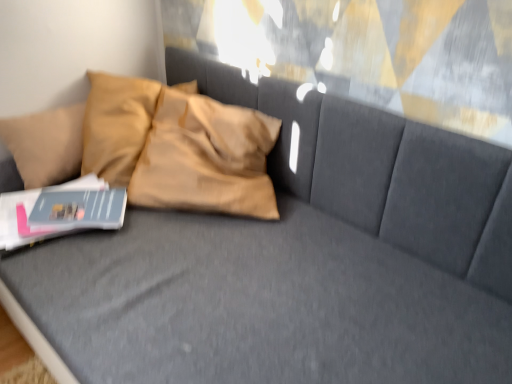
Find the location of `blank space situated above matte gray book at lower left (from a real-world perspective)`. blank space situated above matte gray book at lower left (from a real-world perspective) is located at coordinates (48, 211).